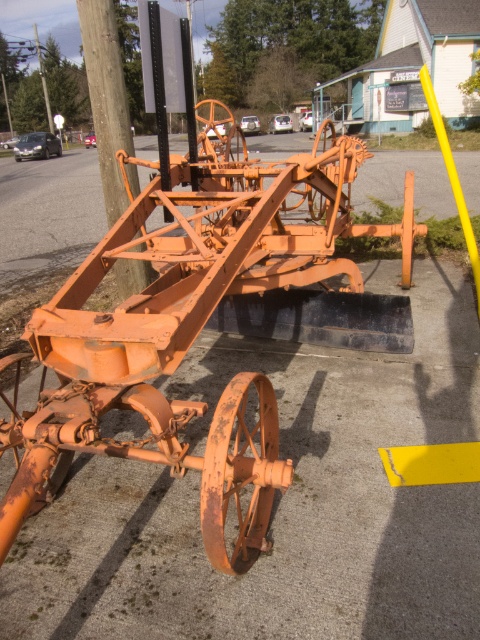
From the picture: You are a photographer trying to capture the rusty orange tractor at center and the brushed metal telegraph pole at upper left in the same frame. Based on their positions, which object would appear closer to the camera in your photo?

The rusty orange tractor at center appears closer to the camera because it is positioned in front of the brushed metal telegraph pole at upper left.